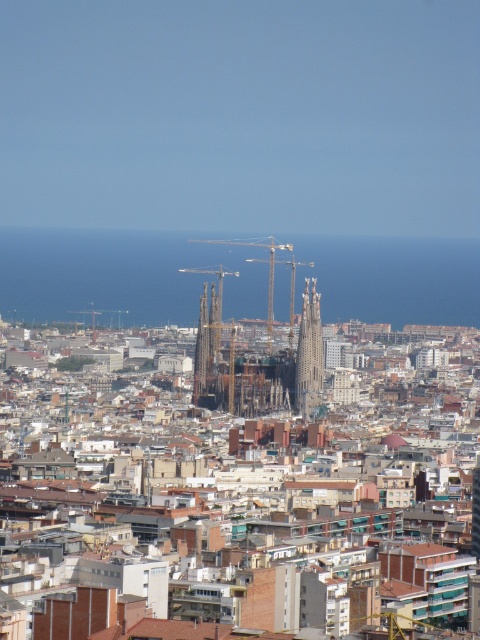
In the scene shown: You are a tourist standing in Barcelona and looking at the Sagrada Familia cathedral. You notice two towers in the center of the image. Which tower is smaller? The gray stone tower at center or the dark brown stone tower at center?

The gray stone tower at center is smaller than the dark brown stone tower at center.